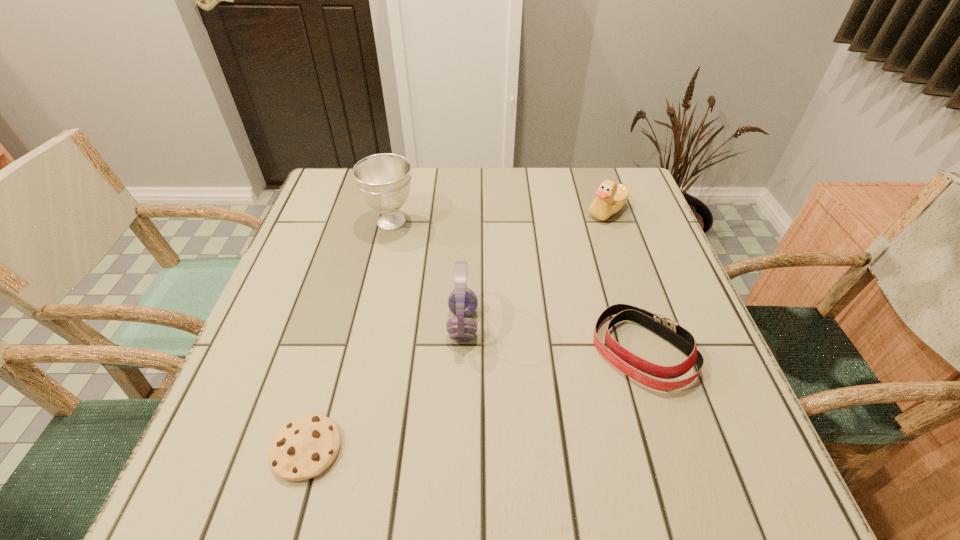
Find the location of a particular element. chalice is located at coordinates (384, 180).

At what (x,y) coordinates should I click in order to perform the action: click on headset. Please return your answer as a coordinate pair (x, y). Looking at the image, I should click on (462, 302).

Locate an element on the screen. This screenshot has height=540, width=960. duck is located at coordinates (611, 197).

Where is `the second shortest object`? the second shortest object is located at coordinates (668, 329).

At what (x,y) coordinates should I click in order to perform the action: click on the nearest object. Please return your answer as a coordinate pair (x, y). The image size is (960, 540). Looking at the image, I should click on (305, 447).

Where is `the shortest object`? The height and width of the screenshot is (540, 960). the shortest object is located at coordinates (305, 447).

Locate an element on the screen. vacant space positioned on the front of the chalice is located at coordinates (367, 330).

At what (x,y) coordinates should I click in order to perform the action: click on free region located on the headband and ear cups of the third object from right to left. Please return your answer as a coordinate pair (x, y). Looking at the image, I should click on (545, 325).

Where is `free space located at the beak of the duck`? The image size is (960, 540). free space located at the beak of the duck is located at coordinates (538, 212).

Where is `vacant area located 0.290m at the beak of the duck`? The height and width of the screenshot is (540, 960). vacant area located 0.290m at the beak of the duck is located at coordinates (x=479, y=212).